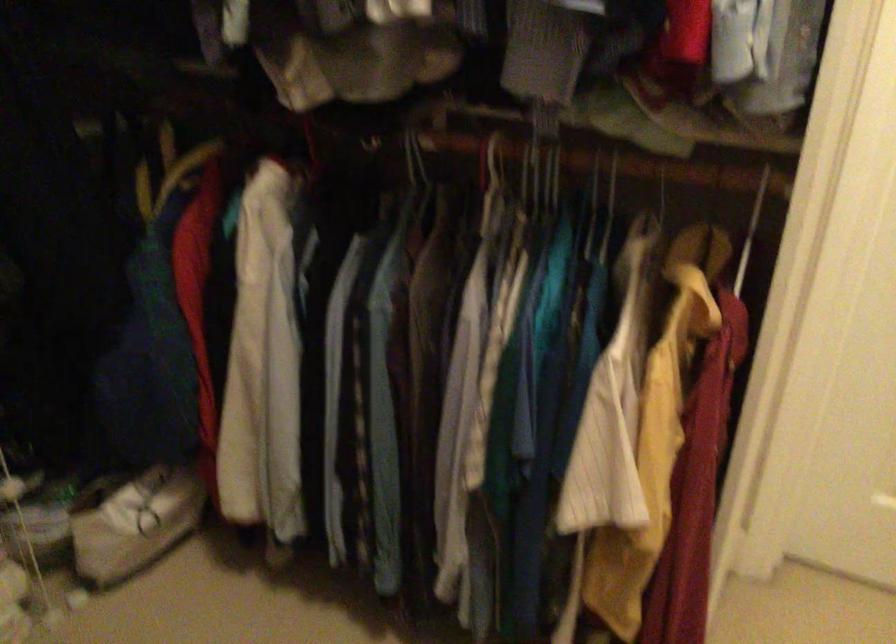
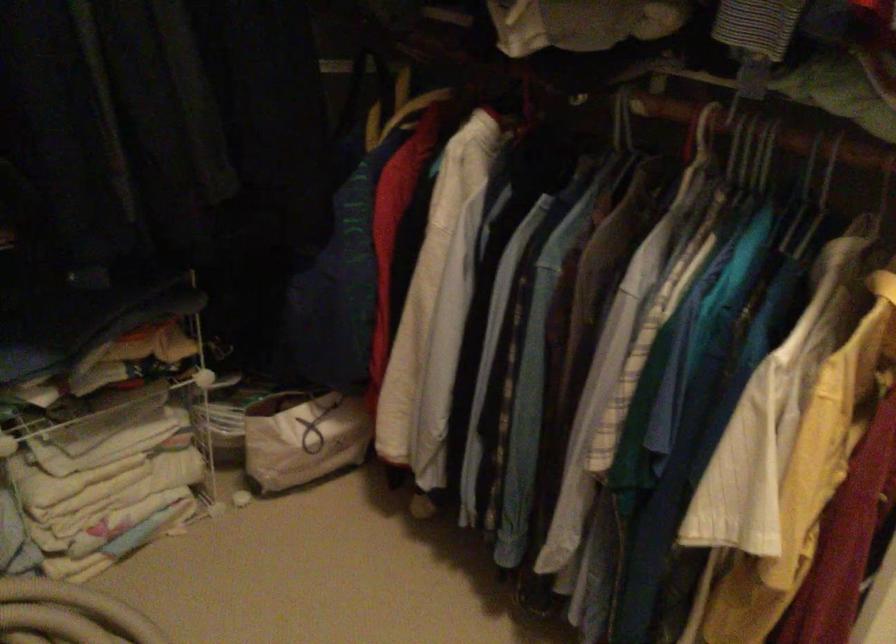
Locate, in the second image, the point that corresponds to (x=152, y=511) in the first image.

(314, 430)